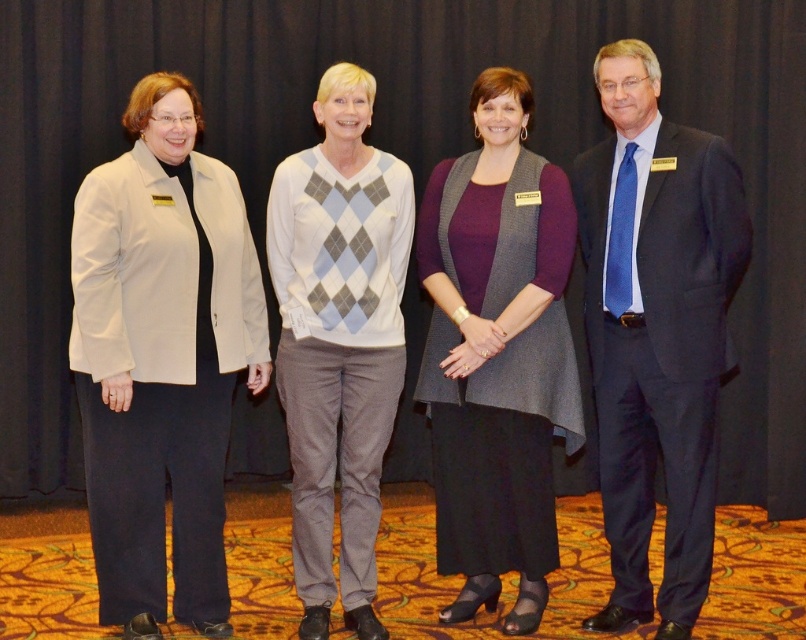
Which is below, beige fabric jacket at left or white argyle sweater at center?

beige fabric jacket at left is lower down.

Does point (140, 416) come in front of point (285, 296)?

Yes, it is in front of point (285, 296).

Locate an element on the screen. This screenshot has width=806, height=640. beige fabric jacket at left is located at coordinates (161, 358).

The width and height of the screenshot is (806, 640). Describe the element at coordinates (497, 353) in the screenshot. I see `gray knit vest at center` at that location.

Is gray knit vest at center below white argyle sweater at center?

Yes.

Locate an element on the screen. gray knit vest at center is located at coordinates (497, 353).

Is beige fabric jacket at left further to the viewer compared to dark blue suit at right?

No, beige fabric jacket at left is in front of dark blue suit at right.

Consider the image. Does beige fabric jacket at left have a lesser width compared to dark blue suit at right?

No, beige fabric jacket at left is not thinner than dark blue suit at right.

What are the coordinates of `beige fabric jacket at left` in the screenshot? It's located at tap(161, 358).